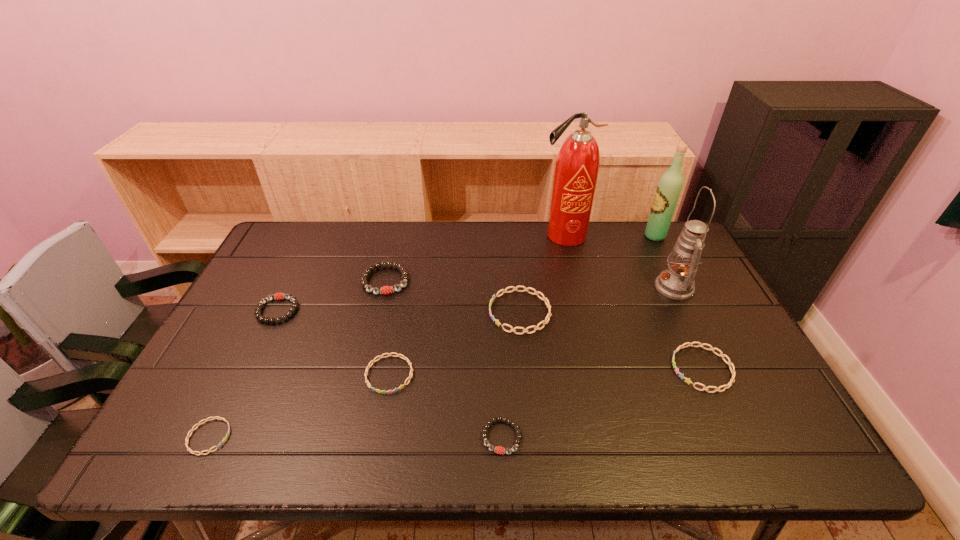
In the image, there is a desktop. Identify the location of free space at the left edge. coord(238,377).

Where is `vacant space at the far left corner`? Image resolution: width=960 pixels, height=540 pixels. vacant space at the far left corner is located at coordinates (305, 234).

Locate an element on the screen. Image resolution: width=960 pixels, height=540 pixels. free space at the far right corner of the desktop is located at coordinates [676, 230].

The image size is (960, 540). I want to click on vacant region between the rightmost black bracelet and the wine bottle, so click(578, 336).

Identify the location of empty location between the rightmost black bracelet and the biggest blue bracelet. (511, 374).

Identify the location of vacant area between the white wine bottle and the fire extinguisher. The width and height of the screenshot is (960, 540). (609, 236).

This screenshot has width=960, height=540. I want to click on vacant space that's between the third biggest blue bracelet and the farthest blue bracelet, so click(455, 343).

Locate an element on the screen. Image resolution: width=960 pixels, height=540 pixels. unoccupied area between the second blue bracelet from right to left and the gray oil lamp is located at coordinates click(597, 300).

You are a GUI agent. You are given a task and a screenshot of the screen. Output one action in this format:
    pyautogui.click(x=<x>, y=<y>)
    Task: Click on the free area in between the second black bracelet from left to right and the wine bottle
    The image size is (960, 540).
    Given the screenshot: What is the action you would take?
    pyautogui.click(x=520, y=258)

This screenshot has width=960, height=540. What are the coordinates of `unoccupied area between the biggest blue bracelet and the biggest black bracelet` in the screenshot? It's located at (453, 296).